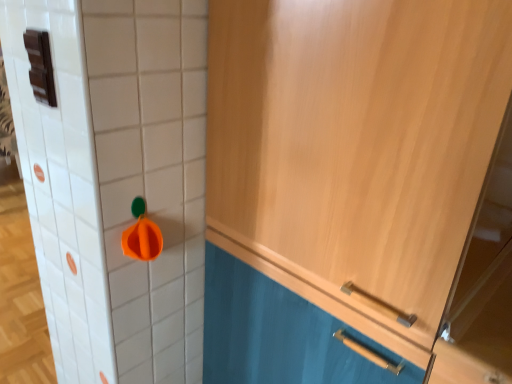
What do you see at coordinates (356, 189) in the screenshot?
I see `light wood cabinet at upper right` at bounding box center [356, 189].

You are a GUI agent. You are given a task and a screenshot of the screen. Output one action in this format:
    pyautogui.click(x=<x>, y=<y>)
    Task: Click on the light wood cabinet at upper right
    The height and width of the screenshot is (384, 512).
    Given the screenshot: What is the action you would take?
    pyautogui.click(x=356, y=189)

Image resolution: width=512 pixels, height=384 pixels. I want to click on light wood cabinet at upper right, so click(x=356, y=189).